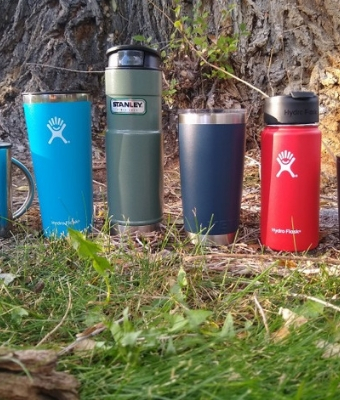
Identify the location of water cups. (7, 172), (48, 157), (140, 146), (193, 147), (296, 152).